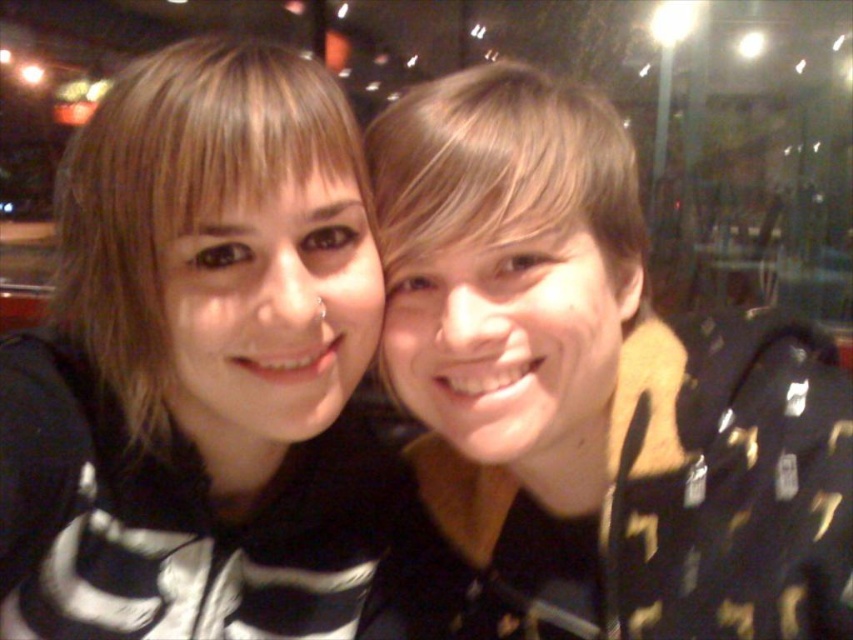
Question: Is black matte jacket at right above black matte hoodie at center?

Choices:
 (A) yes
 (B) no

Answer: (A)

Question: Can you confirm if black matte jacket at right is positioned to the right of black matte hoodie at center?

Choices:
 (A) no
 (B) yes

Answer: (B)

Question: Which object is farther from the camera taking this photo?

Choices:
 (A) black matte jacket at right
 (B) black matte hoodie at center

Answer: (A)

Question: Which point is closer to the camera?

Choices:
 (A) black matte jacket at right
 (B) black matte hoodie at center

Answer: (B)

Question: Which point is farther to the camera?

Choices:
 (A) (558, 410)
 (B) (107, 353)

Answer: (B)

Question: Does black matte jacket at right have a smaller size compared to black matte hoodie at center?

Choices:
 (A) yes
 (B) no

Answer: (B)